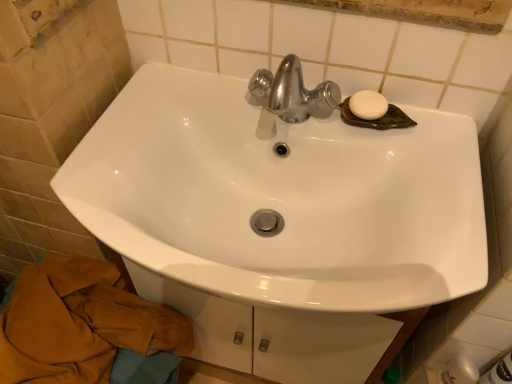
Question: From a real-world perspective, is white matte soap at upper right above or below brown cotton bath towel at lower left?

Choices:
 (A) below
 (B) above

Answer: (B)

Question: From the image's perspective, relative to brown cotton bath towel at lower left, is white matte soap at upper right above or below?

Choices:
 (A) above
 (B) below

Answer: (A)

Question: Which object is positioned farthest from the brown cotton bath towel at lower left?

Choices:
 (A) white glossy sink at center
 (B) white matte soap at upper right

Answer: (B)

Question: Based on their relative distances, which object is nearer to the white matte soap at upper right?

Choices:
 (A) white glossy sink at center
 (B) brown cotton bath towel at lower left

Answer: (A)